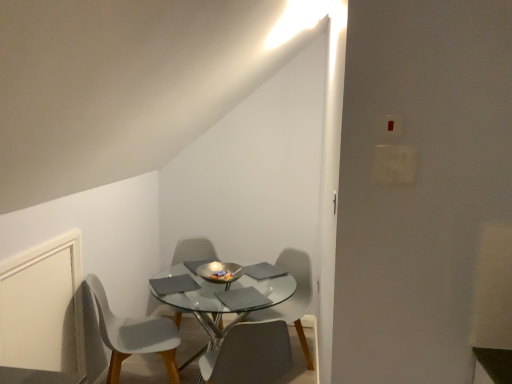
Where is `vacant space situated above white matte door at lower left (from a real-world perspective)`? This screenshot has width=512, height=384. vacant space situated above white matte door at lower left (from a real-world perspective) is located at coordinates (46, 239).